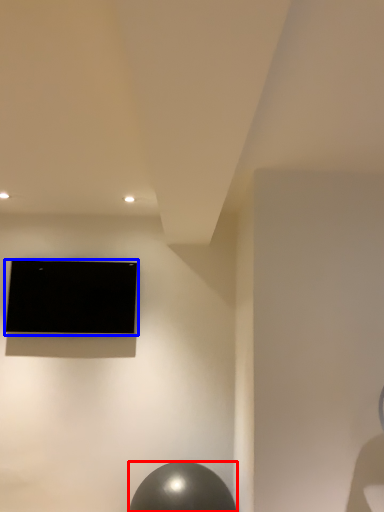
Question: Which object is further to the camera taking this photo, ball (highlighted by a red box) or television (highlighted by a blue box)?

Choices:
 (A) ball
 (B) television

Answer: (B)